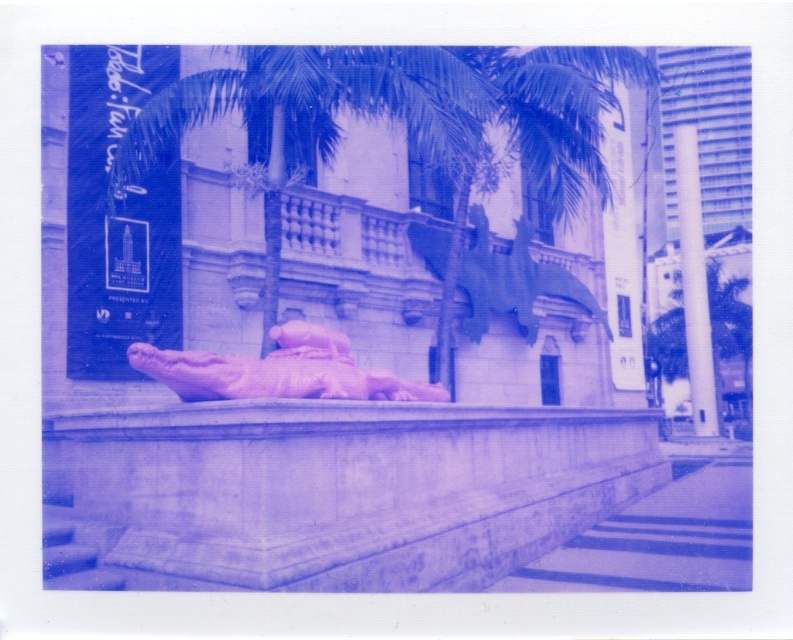
Does point (320, 388) come farther from viewer compared to point (703, 314)?

No, (320, 388) is in front of (703, 314).

Is point (372, 396) closer to viewer compared to point (700, 353)?

Yes.

Identify the location of purple glossy statue at center. (278, 371).

Which is above, green leafy palm tree at center or pink rubber statue at center?

Positioned higher is green leafy palm tree at center.

The width and height of the screenshot is (793, 640). Identify the location of green leafy palm tree at center. (320, 116).

How distant is green leafy palm tree at center from purple glossy statue at center?

green leafy palm tree at center is 3.57 meters from purple glossy statue at center.

Does green leafy palm tree at center have a lesser height compared to purple glossy statue at center?

Incorrect, green leafy palm tree at center's height does not fall short of purple glossy statue at center's.

The image size is (793, 640). Describe the element at coordinates (320, 116) in the screenshot. I see `green leafy palm tree at center` at that location.

The image size is (793, 640). In order to click on green leafy palm tree at center in this screenshot , I will do `click(320, 116)`.